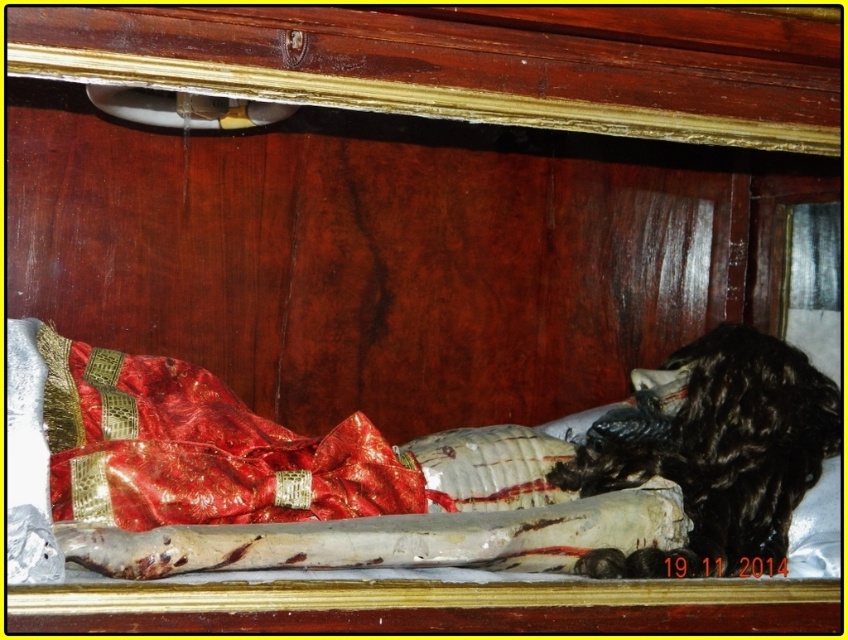
Can you confirm if shiny red fabric at lower left is shorter than black fur animal at right?

Indeed, shiny red fabric at lower left has a lesser height compared to black fur animal at right.

The image size is (848, 640). What do you see at coordinates (198, 449) in the screenshot?
I see `shiny red fabric at lower left` at bounding box center [198, 449].

Which is in front, point (103, 477) or point (584, 477)?

Point (103, 477)

Where is `shiny red fabric at lower left`? This screenshot has width=848, height=640. shiny red fabric at lower left is located at coordinates (x=198, y=449).

Consider the image. Is red satin bed at center to the right of black fur animal at right from the viewer's perspective?

Incorrect, red satin bed at center is not on the right side of black fur animal at right.

Does point (802, 412) come in front of point (653, 440)?

Yes, it is.

Between point (205, 483) and point (774, 474), which one is positioned behind?

The point (774, 474) is more distant.

You are a GUI agent. You are given a task and a screenshot of the screen. Output one action in this format:
    pyautogui.click(x=<x>, y=<y>)
    Task: Click on the red satin bed at center
    The height and width of the screenshot is (640, 848).
    Given the screenshot: What is the action you would take?
    pyautogui.click(x=404, y=474)

Who is more forward, (491, 502) or (134, 442)?

Positioned in front is point (134, 442).

Does red satin bed at center have a lesser height compared to shiny red fabric at lower left?

No, red satin bed at center is not shorter than shiny red fabric at lower left.

Find the location of a particular element. Image resolution: width=848 pixels, height=640 pixels. red satin bed at center is located at coordinates (404, 474).

You are a GUI agent. You are given a task and a screenshot of the screen. Output one action in this format:
    pyautogui.click(x=<x>, y=<y>)
    Task: Click on the red satin bed at center
    
    Given the screenshot: What is the action you would take?
    pyautogui.click(x=404, y=474)